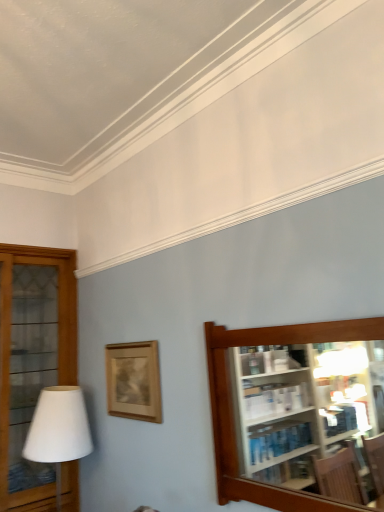
Question: From a real-world perspective, is wooden glass cabinet at left, acting as the first shelf starting from the back, physically located above or below wooden picture frame at center?

Choices:
 (A) above
 (B) below

Answer: (B)

Question: Does point (51, 343) appear closer or farther from the camera than point (137, 404)?

Choices:
 (A) closer
 (B) farther

Answer: (B)

Question: Which of these objects is positioned farthest from the wooden glass cabinet at left, the second shelf from the right?

Choices:
 (A) brown wooden shelf at right, acting as the first shelf starting from the front
 (B) white matte table lamp at left
 (C) wooden picture frame at center

Answer: (A)

Question: Estimate the real-world distances between objects in this image. Which object is farther from the wooden glass cabinet at left, placed as the 2th shelf when sorted from front to back?

Choices:
 (A) white matte table lamp at left
 (B) brown wooden shelf at right, which appears as the 2th shelf when viewed from the left
 (C) wooden picture frame at center

Answer: (B)